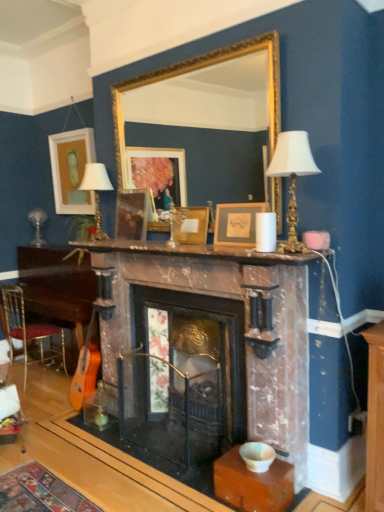
Find the location of a particular element. The width and height of the screenshot is (384, 512). vacant space situated above gold/gilded mirror at upper center (from a real-world perspective) is located at coordinates (189, 56).